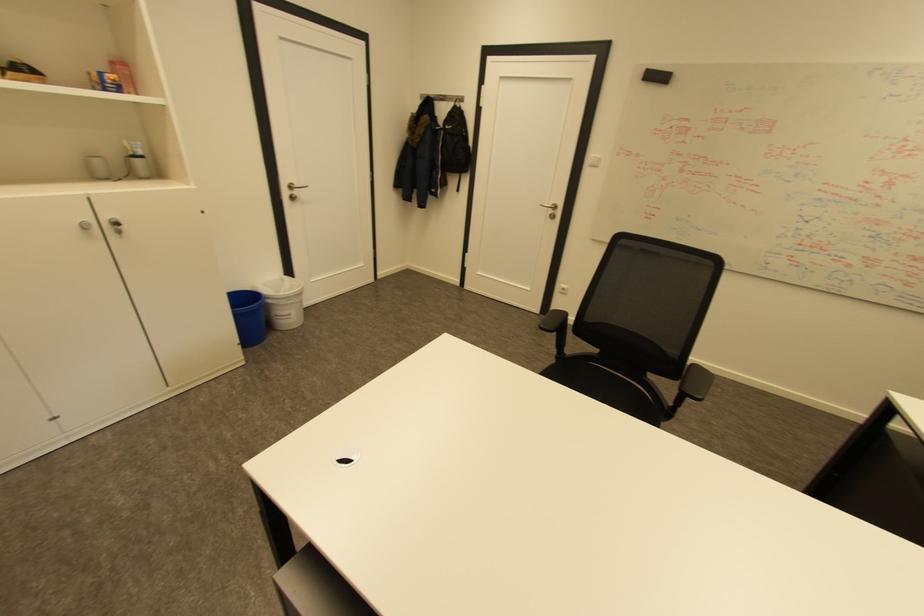
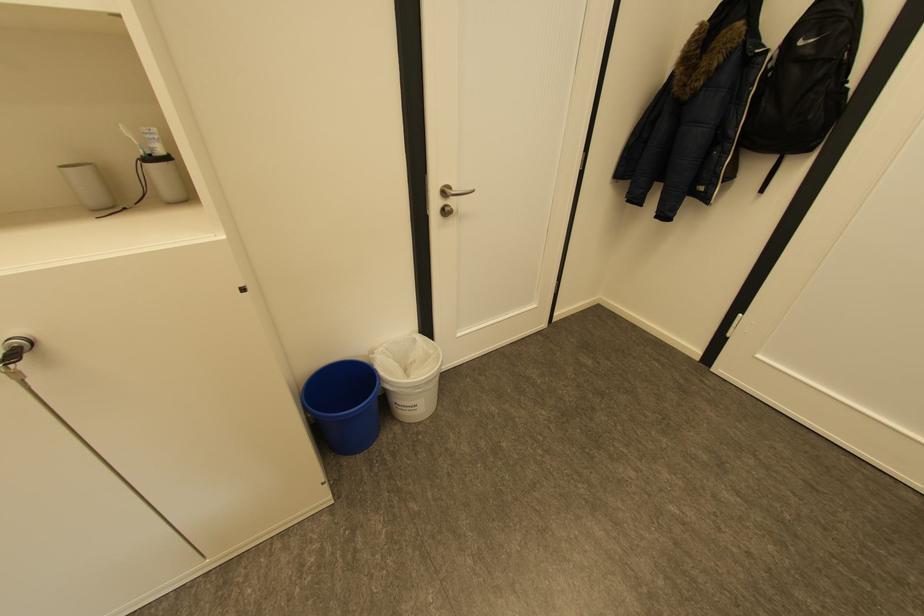
In the second image, find the point that corresponds to (x=272, y=285) in the first image.

(394, 349)